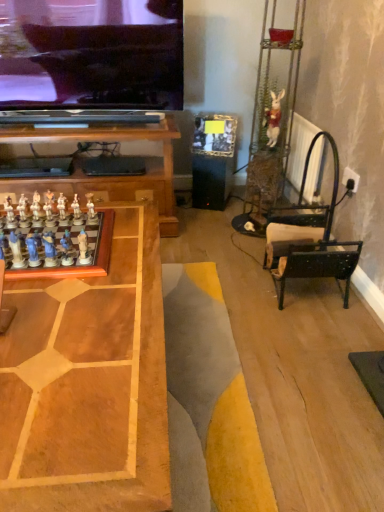
Locate an element on the screen. free spot behind white glossy chess piece at center-left, which is counted as the tenth toy, starting from the left is located at coordinates (116, 232).